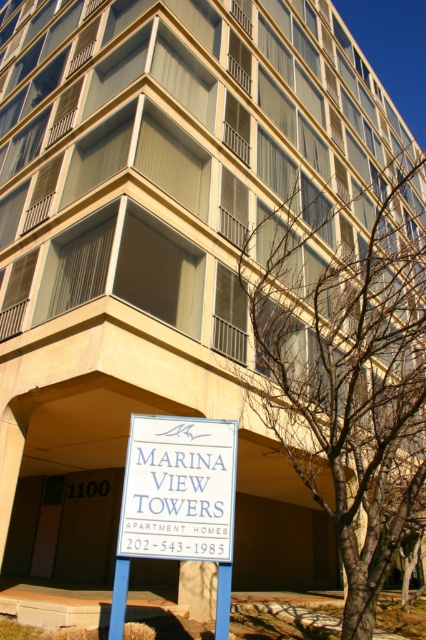
You are standing at the base of the building and want to place a 3.5 meter ladder between the bare branches at center and the white plastic sign at lower center. Can the ladder fit between them without overlapping either object?

The distance between the bare branches at center and the white plastic sign at lower center is 6.53 meters. Since the ladder is 3.5 meters long, it can fit between them without overlapping either object because 3.5 meters is shorter than 6.53 meters.

You are looking at the Marina View Towers building. There is a point marked at coordinates (x=348, y=380). What is located at that point?

The point at coordinates (x=348, y=380) indicates bare branches at center.